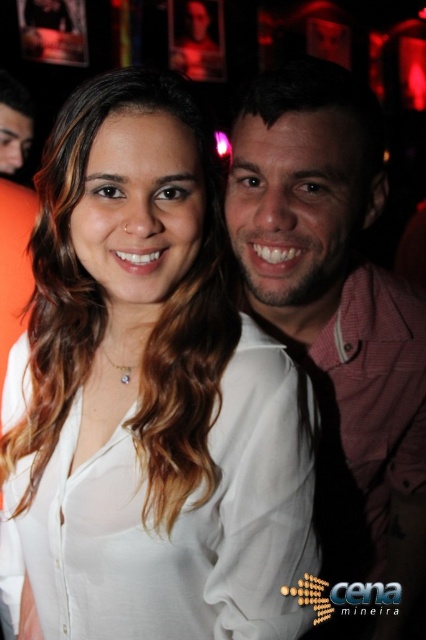
Is white silky blouse at center positioned before matte pink shirt at center?

That is True.

Is white silky blouse at center further to camera compared to matte pink shirt at center?

No, it is in front of matte pink shirt at center.

Between point (245, 593) and point (420, 362), which one is positioned in front?

Positioned in front is point (245, 593).

Find the location of a particular element. white silky blouse at center is located at coordinates (152, 394).